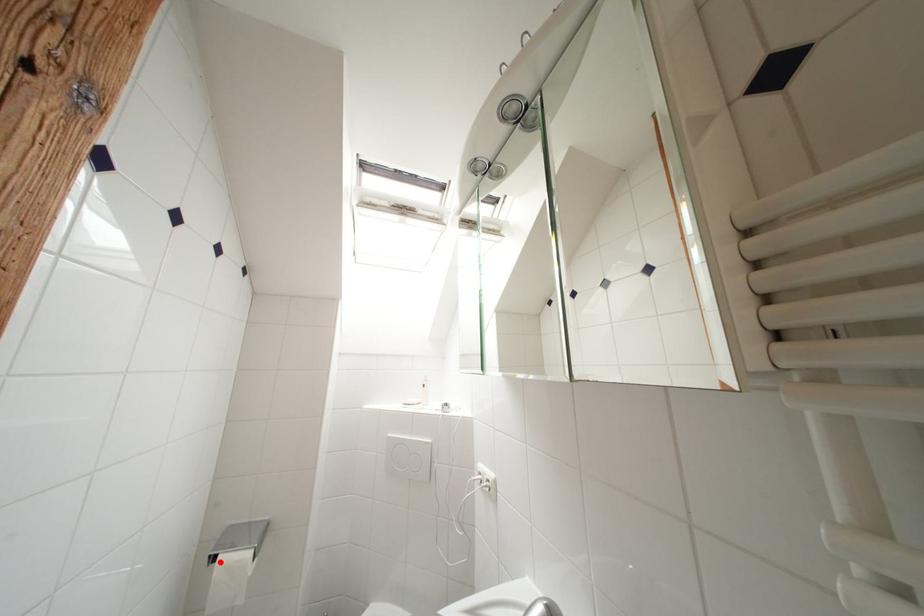
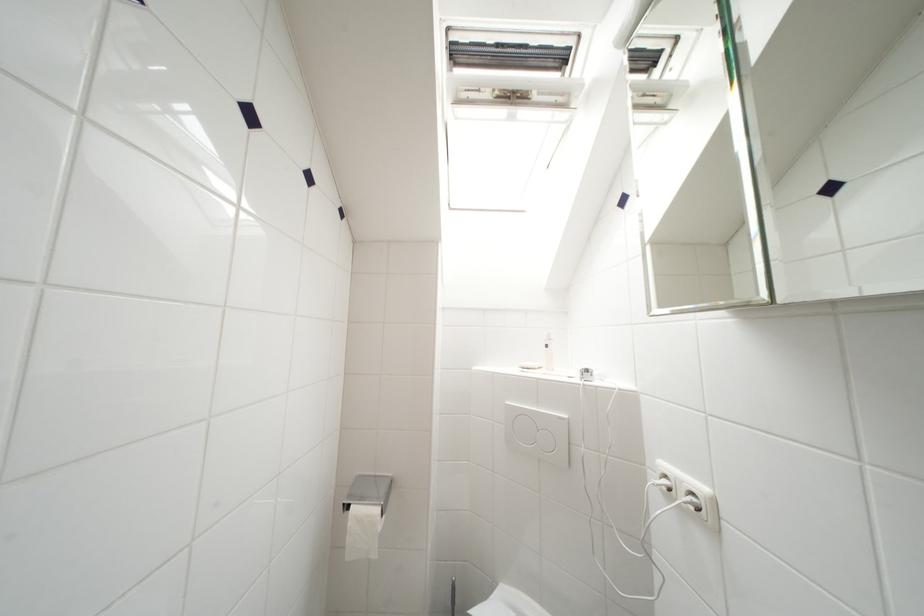
Question: I am providing you with two images of the same scene from different viewpoints. A red point is marked on the first image. Is the red point's position out of view in image 2?

Choices:
 (A) Yes
 (B) No

Answer: (B)